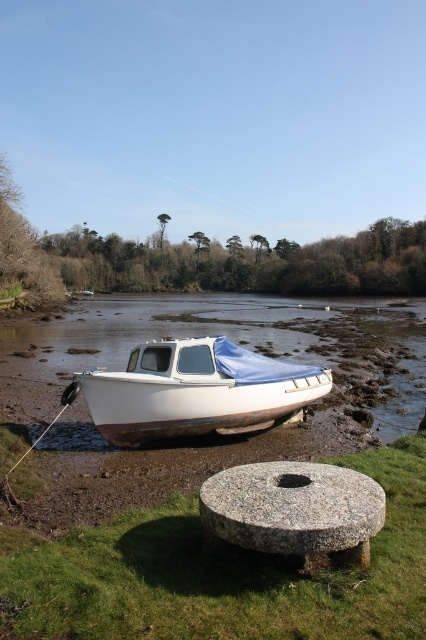
You are standing at the riverside and want to walk from the white matte boat at center to the granite millstone at lower center. Which direction should you move to reach it?

The granite millstone at lower center is located below the white matte boat at center, so you should move downward to reach it.

You are standing at the point with coordinates point (196, 390). What object are you standing on?

You are standing on the white matte boat at center.

You are standing at the point marked as point [222,573] in the image. Looking around, you see a large round stone millstone and a small white boat with a blue tarp. Which object is closer to your current position?

The point [222,573] is on green grass at center, so the large round stone millstone is closer to your position as it is described to be in the foreground, while the boat is in the middle ground farther away.